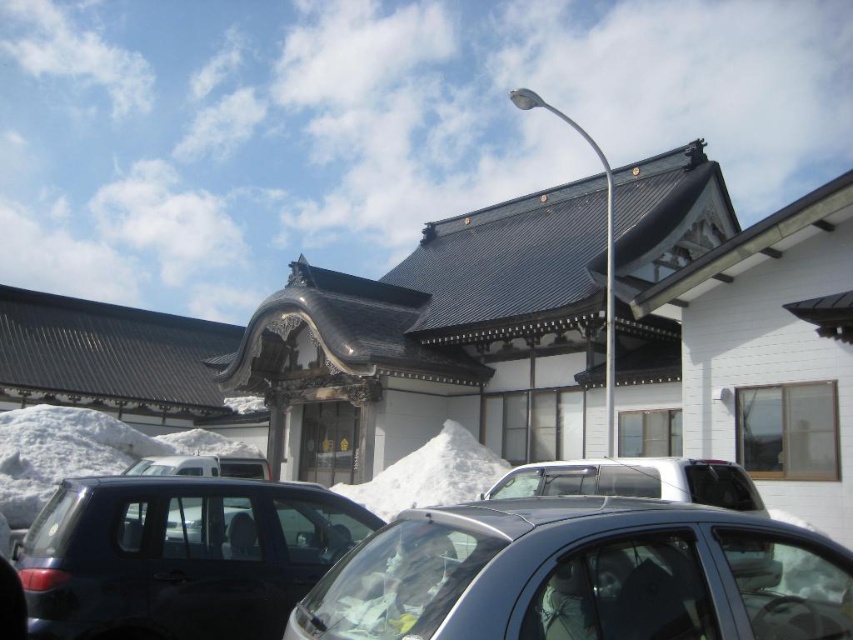
You are a delivery person trying to park your vehicle in the parking lot near the traditional Japanese building. You see the satin black suv at lower left and the white fluffy snow at center. Which area has more space available for parking?

The white fluffy snow at center has more space available for parking because the satin black suv at lower left occupies less space than it.

You are a visitor at this traditional Japanese building and need to park your car. You see a satin black car at center and a satin black suv at lower left. Which one is closer to the entrance of the building?

The satin black suv at lower left is closer to the entrance of the building because it is positioned to the left of the satin black car at center, which is further to the right.